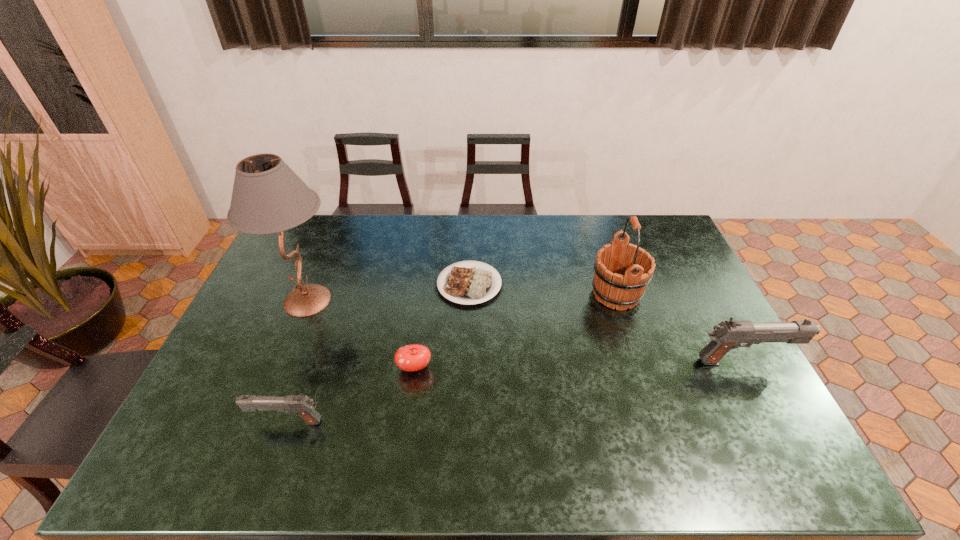
Locate an element on the screen. Image resolution: width=960 pixels, height=540 pixels. vacant area situated in the direction the left gun is aimed is located at coordinates (227, 422).

Find the location of `vacant space positioned in the direction the left gun is aimed`. vacant space positioned in the direction the left gun is aimed is located at coordinates (186, 422).

Locate an element on the screen. The image size is (960, 540). vacant space located on the front-facing side of the table lamp is located at coordinates (423, 301).

The image size is (960, 540). What are the coordinates of `free space located 0.080m on the right of the plate` in the screenshot? It's located at (530, 285).

Where is `vacant space located on the front of the second shortest object`? This screenshot has height=540, width=960. vacant space located on the front of the second shortest object is located at coordinates (411, 398).

Identify the location of vacant space situated 0.350m on the left of the wine bucket. The height and width of the screenshot is (540, 960). (481, 294).

Where is `object present at the near edge`? object present at the near edge is located at coordinates (302, 405).

Image resolution: width=960 pixels, height=540 pixels. I want to click on object located at the left edge, so click(x=268, y=197).

Locate an element on the screen. The height and width of the screenshot is (540, 960). object that is at the right edge is located at coordinates (727, 335).

In the image, there is a desktop. Identify the location of vacant space at the far edge. (588, 249).